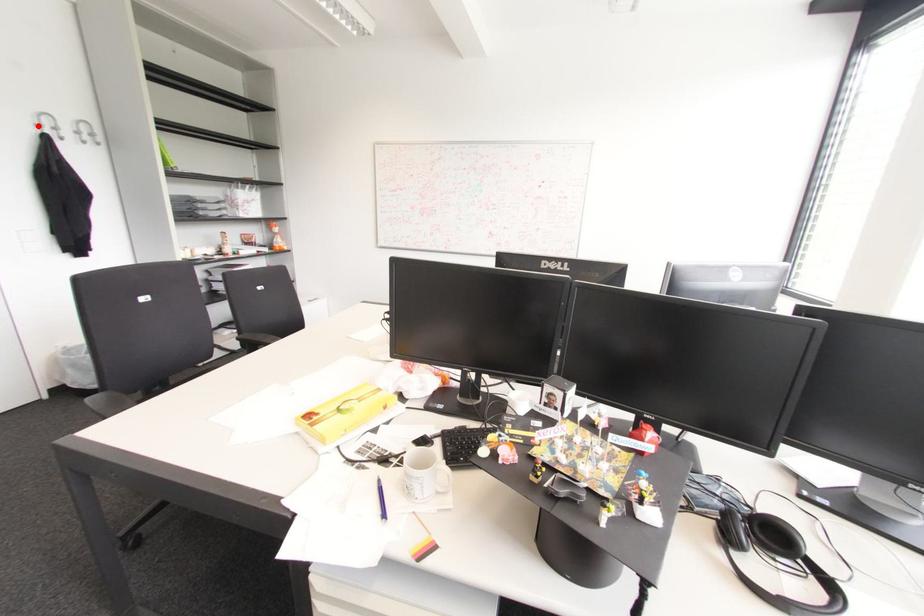
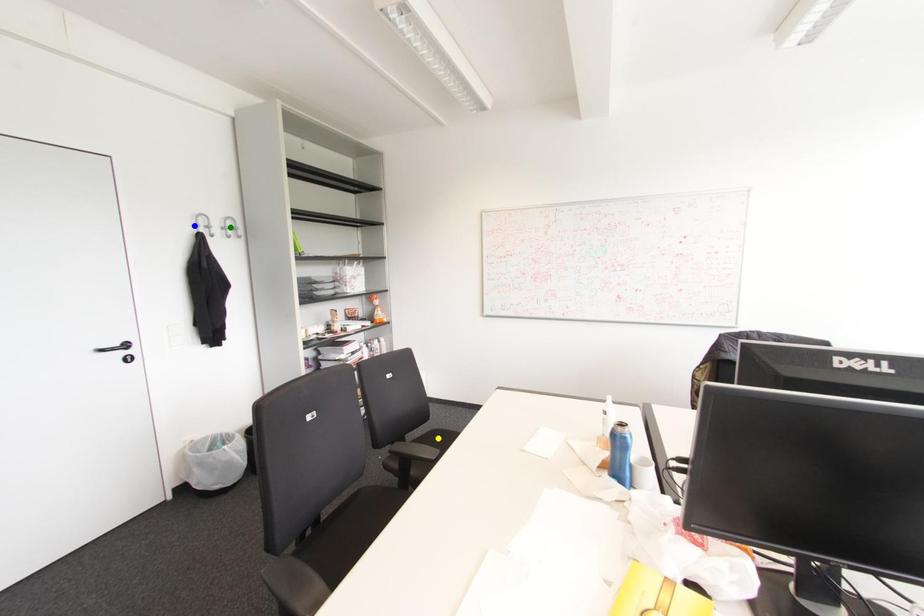
Question: I am providing you with two images of the same scene from different viewpoints. A red point is marked on the first image. You are given multiple points on the second image. Which point in image 2 represents the same 3d spot as the red point in image 1?

Choices:
 (A) green point
 (B) blue point
 (C) yellow point

Answer: (B)